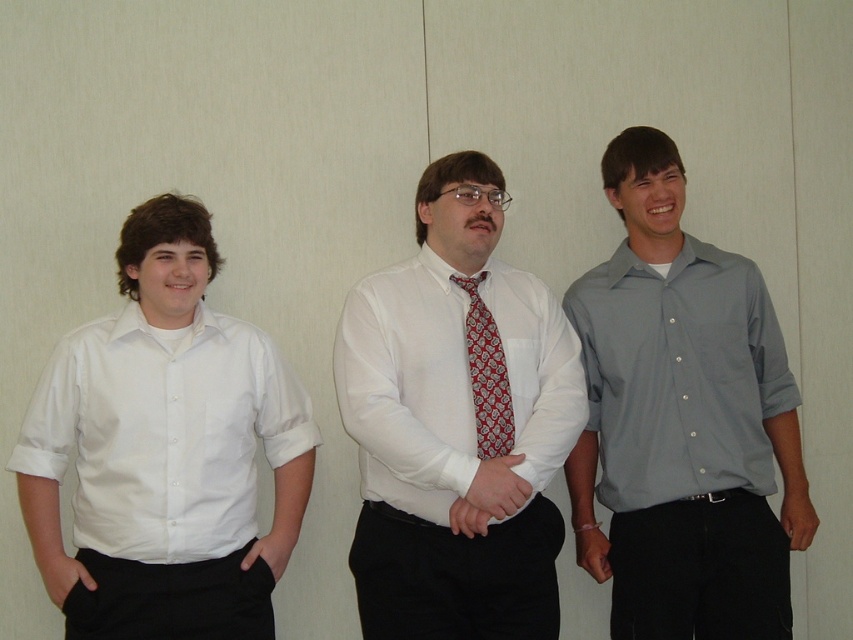
Does white glossy shirt at center appear on the left side of white cotton shirt at left?

Incorrect, white glossy shirt at center is not on the left side of white cotton shirt at left.

Who is positioned more to the right, white glossy shirt at center or white cotton shirt at left?

From the viewer's perspective, white glossy shirt at center appears more on the right side.

Where is `white glossy shirt at center`? This screenshot has width=853, height=640. white glossy shirt at center is located at coordinates (457, 424).

Consider the image. Who is positioned more to the left, light gray button-down shirt at right or red patterned tie at center?

Positioned to the left is red patterned tie at center.

Between light gray button-down shirt at right and red patterned tie at center, which one has more height?

Standing taller between the two is light gray button-down shirt at right.

Which is behind, point (643, 321) or point (479, 413)?

Point (643, 321)

Image resolution: width=853 pixels, height=640 pixels. What are the coordinates of `light gray button-down shirt at right` in the screenshot? It's located at (682, 420).

Consider the image. Does white cotton shirt at left have a greater height compared to red patterned tie at center?

Correct, white cotton shirt at left is much taller as red patterned tie at center.

Can you confirm if white cotton shirt at left is smaller than red patterned tie at center?

No, white cotton shirt at left is not smaller than red patterned tie at center.

At what (x,y) coordinates should I click in order to perform the action: click on white cotton shirt at left. Please return your answer as a coordinate pair (x, y). Image resolution: width=853 pixels, height=640 pixels. Looking at the image, I should click on (163, 433).